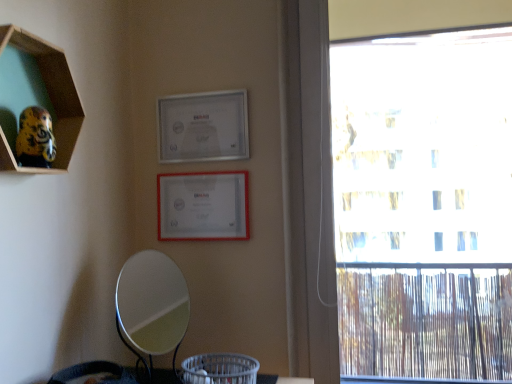
Question: From the image's perspective, is silver metallic picture frame at upper center, which is the first picture frame from top to bottom, on silver/metallic mirror at lower center?

Choices:
 (A) no
 (B) yes

Answer: (B)

Question: Are silver metallic picture frame at upper center, which is the first picture frame from top to bottom, and silver/metallic mirror at lower center located far from each other?

Choices:
 (A) no
 (B) yes

Answer: (A)

Question: Considering the relative sizes of silver metallic picture frame at upper center, which is the first picture frame from top to bottom, and silver/metallic mirror at lower center in the image provided, is silver metallic picture frame at upper center, which is the first picture frame from top to bottom, wider than silver/metallic mirror at lower center?

Choices:
 (A) no
 (B) yes

Answer: (A)

Question: Can you confirm if silver metallic picture frame at upper center, which is the first picture frame from top to bottom, is positioned to the left of silver/metallic mirror at lower center?

Choices:
 (A) no
 (B) yes

Answer: (A)

Question: Are silver metallic picture frame at upper center, which is the first picture frame from top to bottom, and silver/metallic mirror at lower center beside each other?

Choices:
 (A) no
 (B) yes

Answer: (A)

Question: Is point (193, 142) positioned closer to the camera than point (186, 365)?

Choices:
 (A) closer
 (B) farther

Answer: (B)

Question: Considering their positions, is silver metallic picture frame at upper center, the second picture frame positioned from the bottom, located in front of or behind gray woven basket at lower center?

Choices:
 (A) behind
 (B) front

Answer: (A)

Question: Which is correct: silver metallic picture frame at upper center, which is the first picture frame from top to bottom, is inside gray woven basket at lower center, or outside of it?

Choices:
 (A) outside
 (B) inside

Answer: (A)

Question: Considering the relative positions of silver metallic picture frame at upper center, which is the first picture frame from top to bottom, and gray woven basket at lower center in the image provided, is silver metallic picture frame at upper center, which is the first picture frame from top to bottom, to the left or to the right of gray woven basket at lower center?

Choices:
 (A) right
 (B) left

Answer: (B)

Question: In terms of height, does white matte picture frame at upper center, marked as the 2th picture frame in a top-to-bottom arrangement, look taller or shorter compared to gray woven basket at lower center?

Choices:
 (A) tall
 (B) short

Answer: (A)

Question: Considering the positions of white matte picture frame at upper center, which is counted as the first picture frame, starting from the bottom, and gray woven basket at lower center in the image, is white matte picture frame at upper center, which is counted as the first picture frame, starting from the bottom, wider or thinner than gray woven basket at lower center?

Choices:
 (A) wide
 (B) thin

Answer: (B)

Question: From the image's perspective, relative to gray woven basket at lower center, is white matte picture frame at upper center, marked as the 2th picture frame in a top-to-bottom arrangement, above or below?

Choices:
 (A) above
 (B) below

Answer: (A)

Question: Is white matte picture frame at upper center, marked as the 2th picture frame in a top-to-bottom arrangement, in front of or behind gray woven basket at lower center in the image?

Choices:
 (A) behind
 (B) front

Answer: (A)

Question: Considering their positions, is silver metallic picture frame at upper center, the second picture frame positioned from the bottom, located in front of or behind silver/metallic mirror at lower center?

Choices:
 (A) front
 (B) behind

Answer: (B)

Question: From the image's perspective, is silver metallic picture frame at upper center, the second picture frame positioned from the bottom, positioned above or below silver/metallic mirror at lower center?

Choices:
 (A) above
 (B) below

Answer: (A)